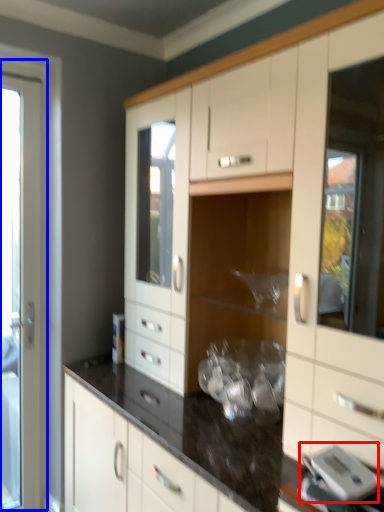
Question: Which object is further to the camera taking this photo, appliance (highlighted by a red box) or screen door (highlighted by a blue box)?

Choices:
 (A) appliance
 (B) screen door

Answer: (B)